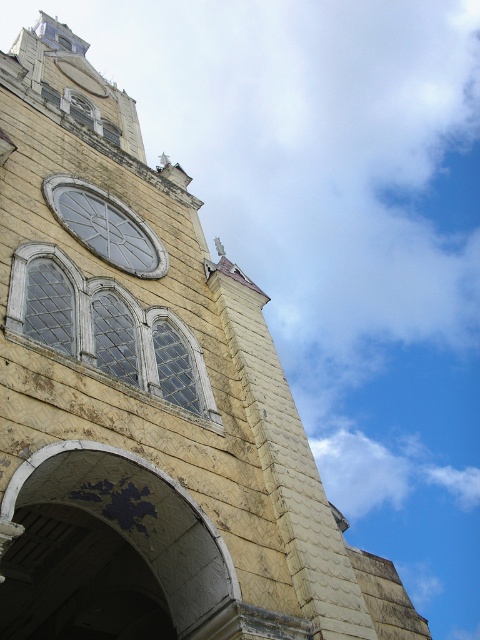
I want to click on clear glass windows at center, so (107, 332).

Between point (157, 346) and point (14, 275), which one is positioned behind?

The point (157, 346) is behind.

Is point (49, 305) closer to camera compared to point (52, 312)?

No, it is not.

Identify the location of clear glass windows at center. This screenshot has width=480, height=640. (107, 332).

I want to click on clear glass window at upper left, so click(x=48, y=300).

At what (x,y) coordinates should I click in order to perform the action: click on clear glass window at upper left. Please return your answer as a coordinate pair (x, y). This screenshot has width=480, height=640. Looking at the image, I should click on (48, 300).

Find the location of `clear glass windows at center`. clear glass windows at center is located at coordinates (107, 332).

Does clear glass windows at center appear on the left side of clear glass window at center?

Correct, you'll find clear glass windows at center to the left of clear glass window at center.

Which is in front, point (127, 387) or point (168, 321)?

Point (127, 387) is more forward.

In order to click on clear glass windows at center in this screenshot , I will do `click(107, 332)`.